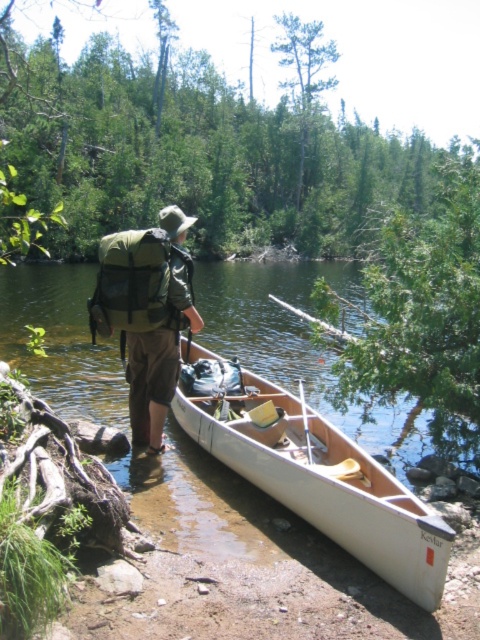
Question: Which object appears farthest from the camera in this image?

Choices:
 (A) white plastic paddle at center
 (B) green fabric backpack at center
 (C) white wood canoe at center
 (D) clear water at center

Answer: (D)

Question: Which point is farther to the camera?

Choices:
 (A) click(183, 474)
 (B) click(300, 465)
 (C) click(111, 275)
 (D) click(310, 458)

Answer: (A)

Question: In this image, where is clear water at center located relative to white plastic paddle at center?

Choices:
 (A) left
 (B) right

Answer: (A)

Question: Does green fabric backpack at center have a greater width compared to white plastic paddle at center?

Choices:
 (A) no
 (B) yes

Answer: (B)

Question: Does clear water at center appear under green fabric backpack at center?

Choices:
 (A) no
 (B) yes

Answer: (A)

Question: Which object is positioned farthest from the white plastic paddle at center?

Choices:
 (A) white wood canoe at center
 (B) green fabric backpack at center

Answer: (B)